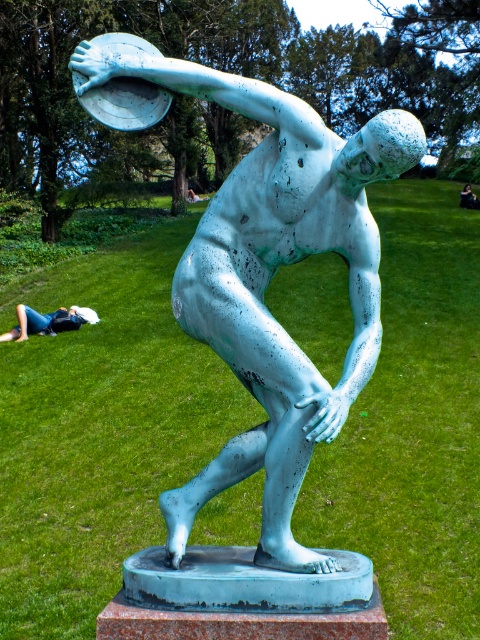
Question: Estimate the real-world distances between objects in this image. Which object is farther from the black fabric person at lower right?

Choices:
 (A) green patina statue at center
 (B) white fabric at lower left

Answer: (A)

Question: Does green patina statue at center appear under black fabric person at lower right?

Choices:
 (A) no
 (B) yes

Answer: (B)

Question: Estimate the real-world distances between objects in this image. Which object is farther from the black fabric person at lower right?

Choices:
 (A) green patina statue at center
 (B) white fabric at lower left

Answer: (A)

Question: Which object is farther from the camera taking this photo?

Choices:
 (A) black fabric person at lower right
 (B) white fabric at lower left
 (C) green patina statue at center

Answer: (A)

Question: Does green patina statue at center appear under white fabric at lower left?

Choices:
 (A) yes
 (B) no

Answer: (A)

Question: Is white fabric at lower left bigger than black fabric person at lower right?

Choices:
 (A) yes
 (B) no

Answer: (A)